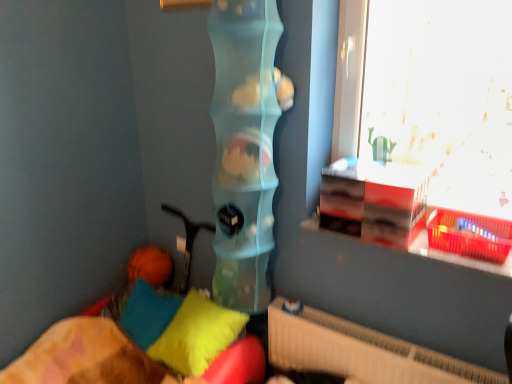
Question: Is white textured radiator at lower right situated inside soft fabric pillows at lower left or outside?

Choices:
 (A) outside
 (B) inside

Answer: (A)

Question: From the image's perspective, is white textured radiator at lower right positioned above or below soft fabric pillows at lower left?

Choices:
 (A) above
 (B) below

Answer: (A)

Question: Which of these objects is positioned farthest from the translucent plastic toy at center?

Choices:
 (A) soft cotton pillow at lower left, the 2th pillow in the right-to-left sequence
 (B) white textured radiator at lower right
 (C) soft plush pillow at lower left, arranged as the 2th pillow when viewed from the left
 (D) soft fabric pillows at lower left
 (E) transparent glass window at upper right

Answer: (E)

Question: Which object is the farthest from the transparent glass window at upper right?

Choices:
 (A) soft fabric pillows at lower left
 (B) soft cotton pillow at lower left, the 2th pillow in the right-to-left sequence
 (C) translucent plastic toy at center
 (D) white textured radiator at lower right
 (E) soft plush pillow at lower left, which is counted as the 1th pillow, starting from the right

Answer: (B)